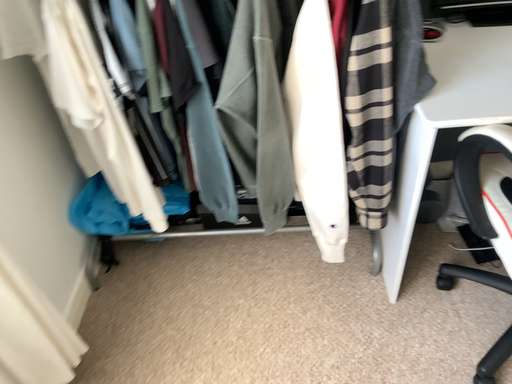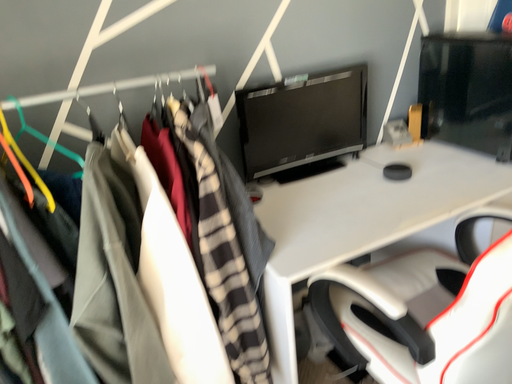
Question: Which way did the camera rotate in the video?

Choices:
 (A) rotated right
 (B) rotated left

Answer: (A)